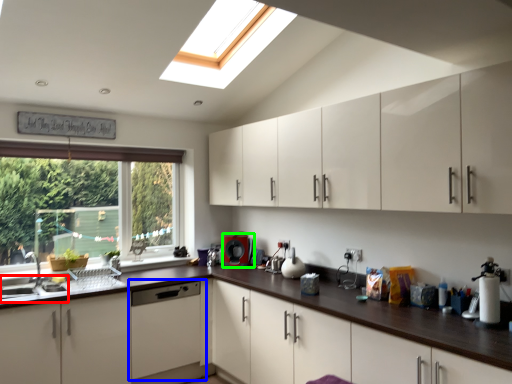
Question: Based on their relative distances, which object is farther from sink (highlighted by a red box)? Choose from home appliance (highlighted by a blue box) and coffee machine (highlighted by a green box).

Choices:
 (A) home appliance
 (B) coffee machine

Answer: (B)